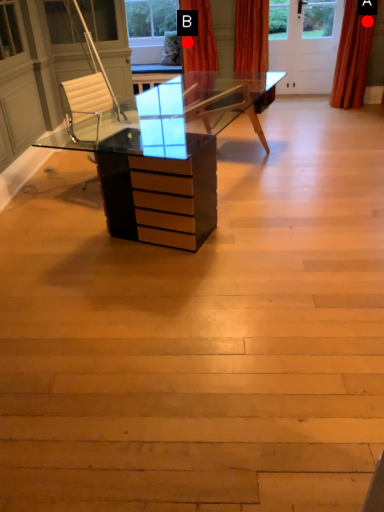
Question: Two points are circled on the image, labeled by A and B beside each circle. Which point is closer to the camera taking this photo?

Choices:
 (A) A is closer
 (B) B is closer

Answer: (B)